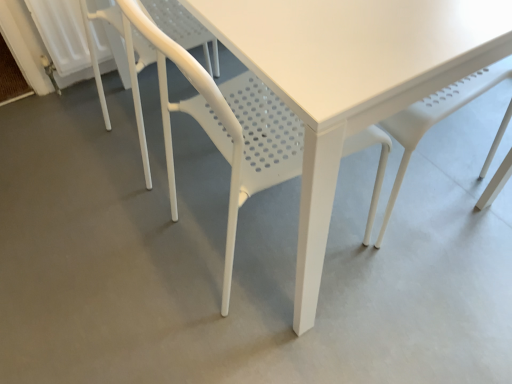
Where is `vacant point to the left of white plastic chair at lower left, acting as the first chair starting from the left`? The width and height of the screenshot is (512, 384). vacant point to the left of white plastic chair at lower left, acting as the first chair starting from the left is located at coordinates (65, 150).